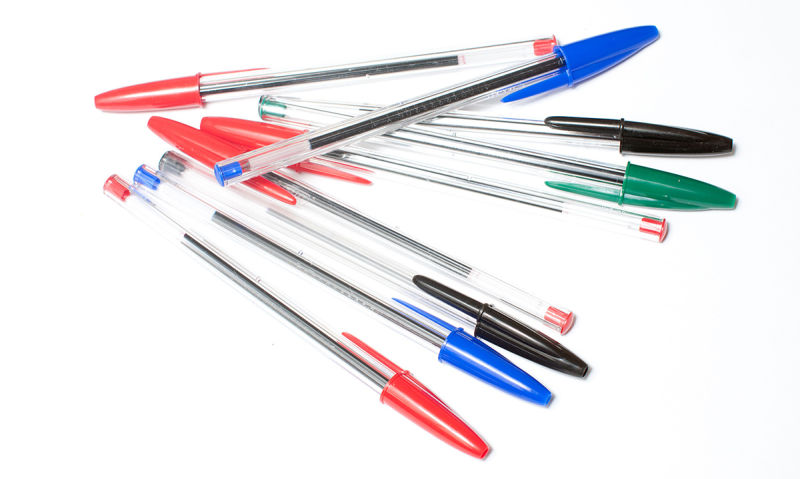
Find the location of a particular element. Image resolution: width=800 pixels, height=479 pixels. pens is located at coordinates (308, 326), (356, 298), (414, 284), (444, 257), (440, 177), (520, 156), (548, 134), (484, 91), (432, 66).